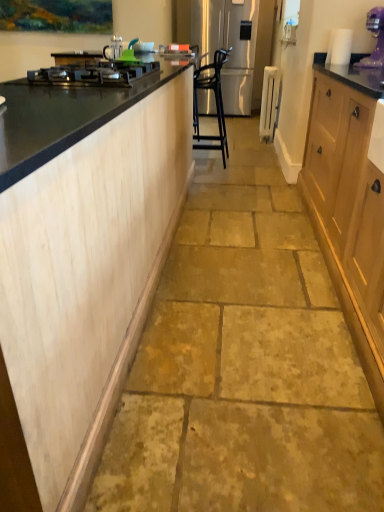
Question: Is satin silver refrigerator at center to the left of purple plastic blender at upper right from the viewer's perspective?

Choices:
 (A) yes
 (B) no

Answer: (A)

Question: Does satin silver refrigerator at center touch purple plastic blender at upper right?

Choices:
 (A) no
 (B) yes

Answer: (A)

Question: Does satin silver refrigerator at center have a smaller size compared to purple plastic blender at upper right?

Choices:
 (A) yes
 (B) no

Answer: (B)

Question: Considering the relative sizes of satin silver refrigerator at center and purple plastic blender at upper right in the image provided, is satin silver refrigerator at center taller than purple plastic blender at upper right?

Choices:
 (A) yes
 (B) no

Answer: (A)

Question: Is satin silver refrigerator at center at the right side of purple plastic blender at upper right?

Choices:
 (A) no
 (B) yes

Answer: (A)

Question: Do you think purple plastic blender at upper right is within satin silver refrigerator at center, or outside of it?

Choices:
 (A) outside
 (B) inside

Answer: (A)

Question: Would you say purple plastic blender at upper right is to the left or to the right of satin silver refrigerator at center in the picture?

Choices:
 (A) left
 (B) right

Answer: (B)

Question: From a real-world perspective, relative to satin silver refrigerator at center, is purple plastic blender at upper right vertically above or below?

Choices:
 (A) below
 (B) above

Answer: (B)

Question: Considering the positions of point (380, 51) and point (236, 12), is point (380, 51) closer or farther from the camera than point (236, 12)?

Choices:
 (A) farther
 (B) closer

Answer: (B)

Question: From a real-world perspective, is black glass cooktop at left physically located above or below light wood cabinetry at left?

Choices:
 (A) below
 (B) above

Answer: (B)

Question: Is black glass cooktop at left in front of or behind light wood cabinetry at left in the image?

Choices:
 (A) front
 (B) behind

Answer: (B)

Question: Is black glass cooktop at left inside or outside of light wood cabinetry at left?

Choices:
 (A) outside
 (B) inside

Answer: (B)

Question: Looking at their shapes, would you say black glass cooktop at left is wider or thinner than light wood cabinetry at left?

Choices:
 (A) wide
 (B) thin

Answer: (B)

Question: Considering the positions of satin silver refrigerator at center and black glass cooktop at left in the image, is satin silver refrigerator at center bigger or smaller than black glass cooktop at left?

Choices:
 (A) small
 (B) big

Answer: (B)

Question: Which is correct: satin silver refrigerator at center is inside black glass cooktop at left, or outside of it?

Choices:
 (A) inside
 (B) outside

Answer: (B)